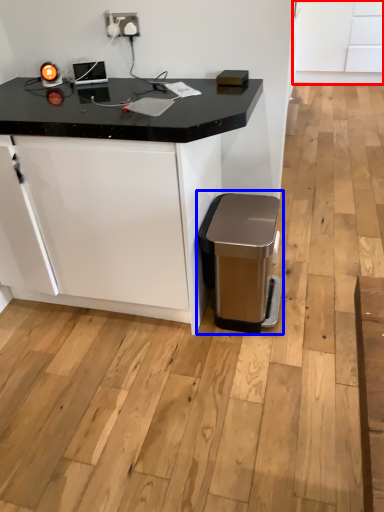
Question: Which of the following is the closest to the observer, cabinetry (highlighted by a red box) or waste container (highlighted by a blue box)?

Choices:
 (A) cabinetry
 (B) waste container

Answer: (B)